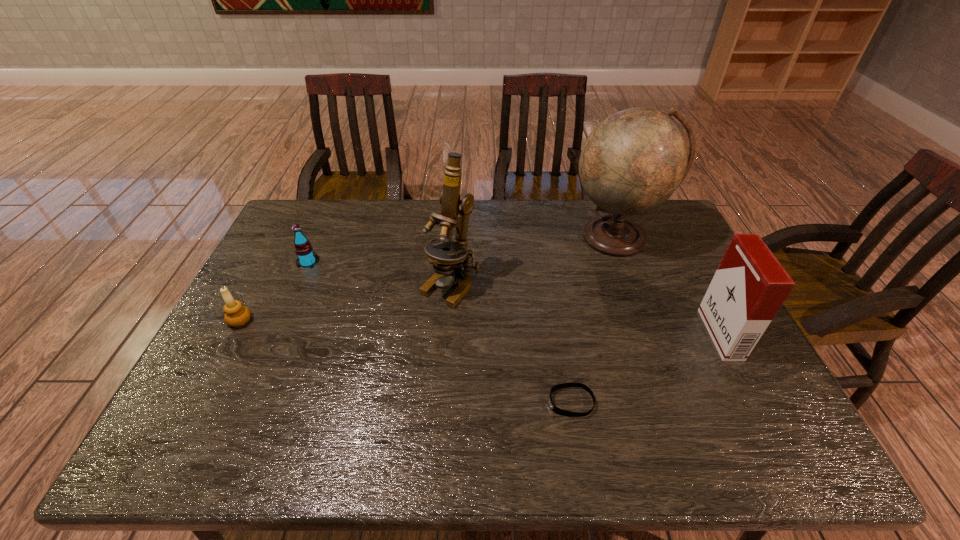
This screenshot has width=960, height=540. In order to click on globe present at the right edge in this screenshot , I will do `click(633, 161)`.

Image resolution: width=960 pixels, height=540 pixels. Identify the location of cigarette_case present at the right edge. (750, 285).

This screenshot has width=960, height=540. In order to click on object that is at the far right corner in this screenshot , I will do `click(633, 161)`.

In the image, there is a desktop. What are the coordinates of `vacant space at the far edge` in the screenshot? It's located at point(408,234).

In the image, there is a desktop. Where is `vacant space at the near edge`? The height and width of the screenshot is (540, 960). vacant space at the near edge is located at coordinates (446, 431).

Where is `vacant space at the right edge of the desktop`? This screenshot has width=960, height=540. vacant space at the right edge of the desktop is located at coordinates (758, 414).

Where is `vacant space at the far left corner of the desktop`? Image resolution: width=960 pixels, height=540 pixels. vacant space at the far left corner of the desktop is located at coordinates (311, 210).

Identify the location of free spot at the near left corner of the desktop. The width and height of the screenshot is (960, 540). (198, 440).

The image size is (960, 540). Find the location of `free space at the far right corner of the desktop`. free space at the far right corner of the desktop is located at coordinates (644, 226).

Where is `vacant area between the candle_holder and the microscope`? vacant area between the candle_holder and the microscope is located at coordinates (346, 303).